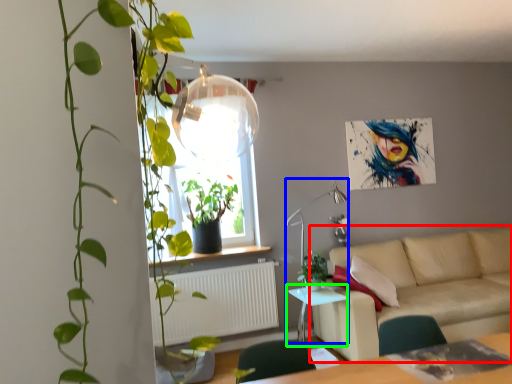
Question: Which object is the closest to the studio couch (highlighted by a red box)? Choose among these: lamp (highlighted by a blue box) or table (highlighted by a green box).

Choices:
 (A) lamp
 (B) table

Answer: (B)